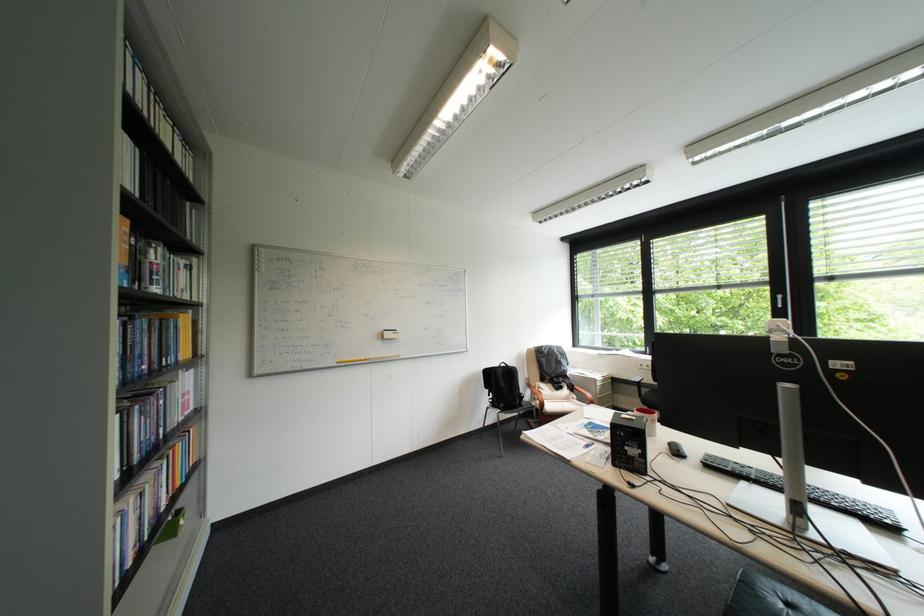
This screenshot has width=924, height=616. In order to click on black keyboard in this screenshot , I will do coord(808,493).